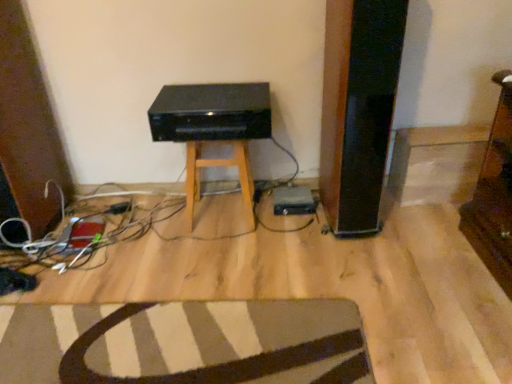
Locate an element on the screen. empty space that is in between black matte stool at center and striped fabric rug at lower center is located at coordinates (198, 262).